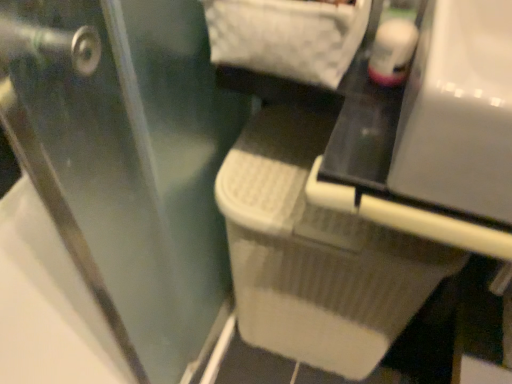
I want to click on blank space above white textured laundry basket at center (from a real-world perspective), so click(298, 190).